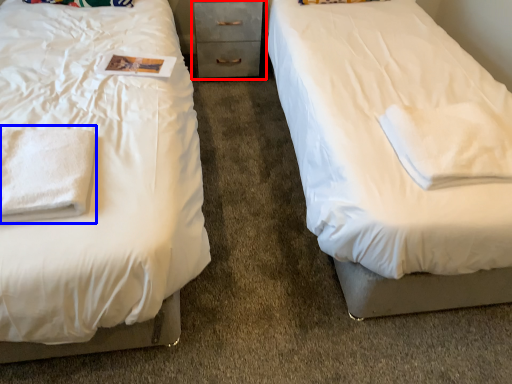
Question: Which of the following is the closest to the observer, chest of drawers (highlighted by a red box) or cloth (highlighted by a blue box)?

Choices:
 (A) chest of drawers
 (B) cloth

Answer: (B)